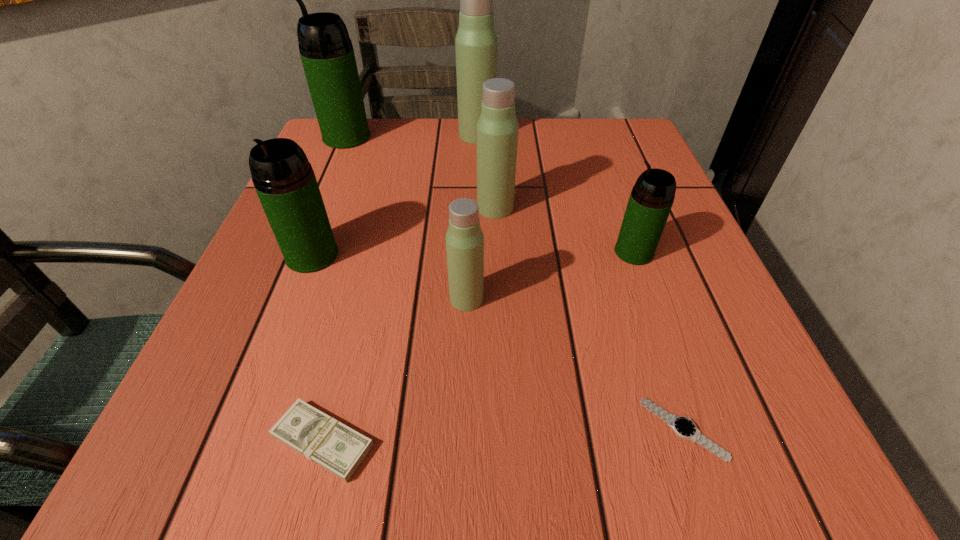
The height and width of the screenshot is (540, 960). What are the coordinates of `vacant position at the right edge of the desktop` in the screenshot? It's located at (632, 177).

This screenshot has width=960, height=540. Find the location of `free location at the near left corner of the desktop`. free location at the near left corner of the desktop is located at coordinates (227, 446).

Locate an element on the screen. This screenshot has width=960, height=540. free space at the far right corner is located at coordinates (641, 162).

Find the location of a particular element. The image size is (960, 540). free area in between the shortest object and the biggest green thermos bottle is located at coordinates (515, 283).

The image size is (960, 540). I want to click on vacant space that's between the farthest light thermos bottle and the farthest green thermos bottle, so tap(412, 136).

Image resolution: width=960 pixels, height=540 pixels. In order to click on vacant region between the second smallest green thermos bottle and the second shortest object in this screenshot , I will do `click(318, 348)`.

Image resolution: width=960 pixels, height=540 pixels. Identify the location of vacant space that's between the seventh tallest object and the second smallest green thermos bottle. (318, 348).

Identify the location of free space between the shortest object and the second smallest light thermos bottle. coord(589,319).

I want to click on free spot between the watch and the second smallest green thermos bottle, so click(x=497, y=342).

This screenshot has height=540, width=960. In order to click on vacant region between the fourth nearest thermos bottle and the farthest green thermos bottle in this screenshot , I will do `click(420, 172)`.